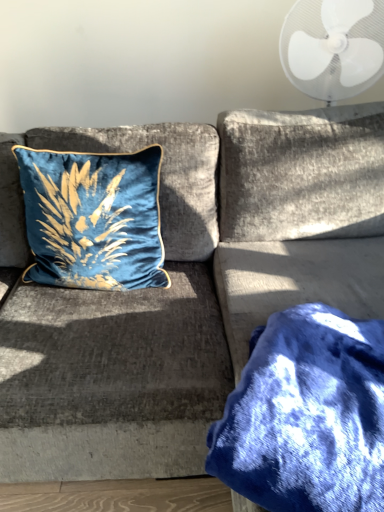
The image size is (384, 512). What do you see at coordinates (306, 415) in the screenshot?
I see `blue fuzzy blanket at lower right` at bounding box center [306, 415].

At what (x,y) coordinates should I click in order to perform the action: click on velvet blue pillow at upper left. Please return your answer as a coordinate pair (x, y). The width and height of the screenshot is (384, 512). Looking at the image, I should click on (93, 218).

Find the location of a particular element. white plastic fan at upper right is located at coordinates (333, 47).

Is white plastic fan at upper right spatially inside blue fuzzy blanket at lower right, or outside of it?

white plastic fan at upper right lies outside blue fuzzy blanket at lower right.

Is blue fuzzy blanket at lower right at the back of white plastic fan at upper right?

white plastic fan at upper right is not turned away from blue fuzzy blanket at lower right.

From the image's perspective, is white plastic fan at upper right below blue fuzzy blanket at lower right?

Incorrect, from the image's perspective, white plastic fan at upper right is higher than blue fuzzy blanket at lower right.

From a real-world perspective, does blue fuzzy blanket at lower right sit lower than velvet blue pillow at upper left?

Yes, from a real-world perspective, blue fuzzy blanket at lower right is below velvet blue pillow at upper left.

Is blue fuzzy blanket at lower right wider or thinner than velvet blue pillow at upper left?

Considering their sizes, blue fuzzy blanket at lower right looks broader than velvet blue pillow at upper left.

Does blue fuzzy blanket at lower right have a greater height compared to velvet blue pillow at upper left?

In fact, blue fuzzy blanket at lower right may be shorter than velvet blue pillow at upper left.

Which is behind, blue fuzzy blanket at lower right or velvet blue pillow at upper left?

velvet blue pillow at upper left.

At what (x,y) coordinates should I click in order to perform the action: click on blanket below the white plastic fan at upper right (from the image's perspective). Please return your answer as a coordinate pair (x, y). The width and height of the screenshot is (384, 512). Looking at the image, I should click on (306, 415).

Which is behind, point (290, 494) or point (318, 59)?

The point (318, 59) is behind.

Considering the relative sizes of blue fuzzy blanket at lower right and white plastic fan at upper right in the image provided, is blue fuzzy blanket at lower right bigger than white plastic fan at upper right?

Actually, blue fuzzy blanket at lower right might be smaller than white plastic fan at upper right.

Could you tell me if blue fuzzy blanket at lower right is facing white plastic fan at upper right?

No, blue fuzzy blanket at lower right is not oriented towards white plastic fan at upper right.

Is velvet blue pillow at upper left oriented away from white plastic fan at upper right?

No, velvet blue pillow at upper left is not facing the opposite direction of white plastic fan at upper right.

Consider the image. From the image's perspective, is velvet blue pillow at upper left under white plastic fan at upper right?

Yes, from the image's perspective, velvet blue pillow at upper left is below white plastic fan at upper right.

Could white plastic fan at upper right be considered to be inside velvet blue pillow at upper left?

No, velvet blue pillow at upper left does not contain white plastic fan at upper right.

In order to click on mechanical fan that appears above the velvet blue pillow at upper left (from the image's perspective) in this screenshot , I will do `click(333, 47)`.

Is velvet blue pillow at upper left not close to blue fuzzy blanket at lower right?

No, velvet blue pillow at upper left is in close proximity to blue fuzzy blanket at lower right.

Between velvet blue pillow at upper left and blue fuzzy blanket at lower right, which one has larger width?

blue fuzzy blanket at lower right is wider.

Can you confirm if velvet blue pillow at upper left is positioned to the right of blue fuzzy blanket at lower right?

Incorrect, velvet blue pillow at upper left is not on the right side of blue fuzzy blanket at lower right.

Is point (84, 185) positioned after point (361, 464)?

That is True.

How different are the orientations of white plastic fan at upper right and velvet blue pillow at upper left in degrees?

11.4 degrees.

Which is more to the left, white plastic fan at upper right or velvet blue pillow at upper left?

velvet blue pillow at upper left.

Relative to velvet blue pillow at upper left, is white plastic fan at upper right in front or behind?

Clearly, white plastic fan at upper right is behind velvet blue pillow at upper left.

The image size is (384, 512). What are the coordinates of `mechanical fan lying on the right of blue fuzzy blanket at lower right` in the screenshot? It's located at (333, 47).

I want to click on pillow above the blue fuzzy blanket at lower right (from a real-world perspective), so click(x=93, y=218).

Looking at the image, which one is located further to white plastic fan at upper right, blue fuzzy blanket at lower right or velvet blue pillow at upper left?

blue fuzzy blanket at lower right is positioned further to the anchor white plastic fan at upper right.

Based on their spatial positions, is velvet blue pillow at upper left or blue fuzzy blanket at lower right further from white plastic fan at upper right?

blue fuzzy blanket at lower right lies further to white plastic fan at upper right than the other object.

Looking at the image, which one is located closer to blue fuzzy blanket at lower right, velvet blue pillow at upper left or white plastic fan at upper right?

Based on the image, velvet blue pillow at upper left appears to be nearer to blue fuzzy blanket at lower right.

Looking at the image, which one is located further to velvet blue pillow at upper left, blue fuzzy blanket at lower right or white plastic fan at upper right?

white plastic fan at upper right lies further to velvet blue pillow at upper left than the other object.

Considering their positions, is white plastic fan at upper right positioned closer to velvet blue pillow at upper left than blue fuzzy blanket at lower right?

The object closer to velvet blue pillow at upper left is blue fuzzy blanket at lower right.

From the image, which object appears to be farther from blue fuzzy blanket at lower right, white plastic fan at upper right or velvet blue pillow at upper left?

The object further to blue fuzzy blanket at lower right is white plastic fan at upper right.

Where is `pillow between white plastic fan at upper right and blue fuzzy blanket at lower right vertically`? pillow between white plastic fan at upper right and blue fuzzy blanket at lower right vertically is located at coordinates (93, 218).